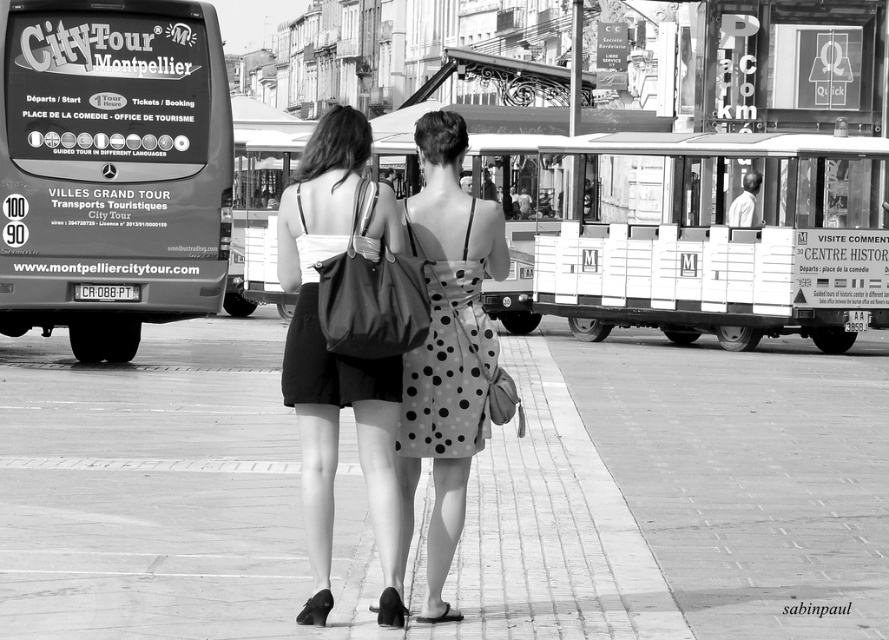
What are the coordinates of the matte black dress at center?

The coordinates of the matte black dress at center are at point (x=337, y=355).

You are standing in the middle of the street looking at the scene. Which object is nearer to you, the smooth concrete pavement at center or the polka dot fabric dress at center?

The smooth concrete pavement at center is closer to the viewer than the polka dot fabric dress at center.